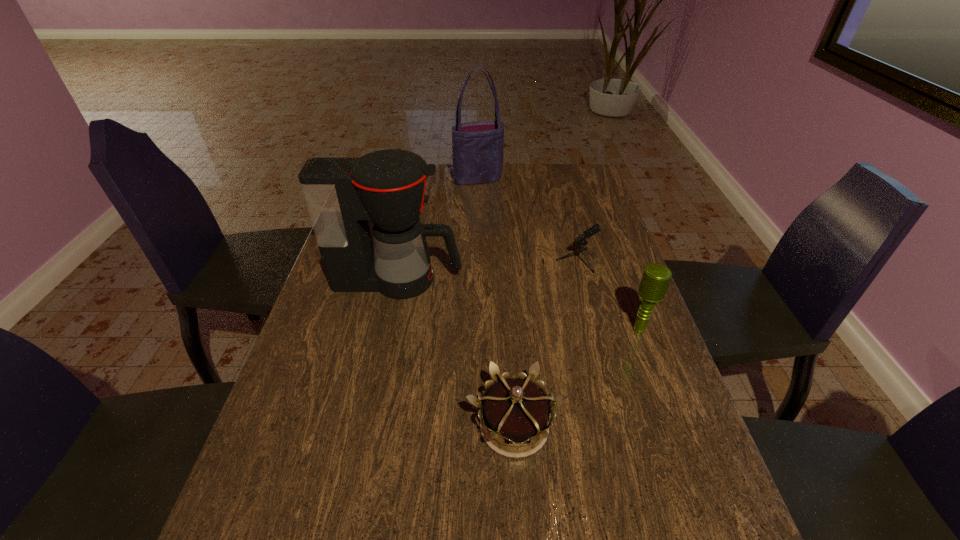
Locate which object is the fourth closest to the nearer microphone. Please provide its 2D coordinates. Your answer should be formatted as a tuple, i.e. [(x, y)], where the tuple contains the x and y coordinates of a point satisfying the conditions above.

[(477, 147)]

Identify the location of free point that satisfies the following two spatial constraints: 1. on the back side of the nearest object; 2. pour from the carafe of the coffee maker. The height and width of the screenshot is (540, 960). coord(505,280).

You are a GUI agent. You are given a task and a screenshot of the screen. Output one action in this format:
    pyautogui.click(x=<x>, y=<y>)
    Task: Click on the vacant area that satisfies the following two spatial constraints: 1. on the back side of the nearest object; 2. pour from the carafe of the coffee maker
    Image resolution: width=960 pixels, height=540 pixels.
    Given the screenshot: What is the action you would take?
    pyautogui.click(x=505, y=280)

You are a GUI agent. You are given a task and a screenshot of the screen. Output one action in this format:
    pyautogui.click(x=<x>, y=<y>)
    Task: Click on the blank area in the image that satisfies the following two spatial constraints: 1. pour from the carafe of the third shortest object; 2. on the left side of the coffee maker
    The height and width of the screenshot is (540, 960).
    Given the screenshot: What is the action you would take?
    pyautogui.click(x=388, y=329)

Locate an element on the screen. This screenshot has width=960, height=540. vacant point that satisfies the following two spatial constraints: 1. on the back side of the right microphone; 2. on the stand of the left microphone is located at coordinates (614, 260).

This screenshot has width=960, height=540. Identify the location of vacant space that satisfies the following two spatial constraints: 1. pour from the carafe of the crown; 2. on the right side of the coffee maker. (367, 426).